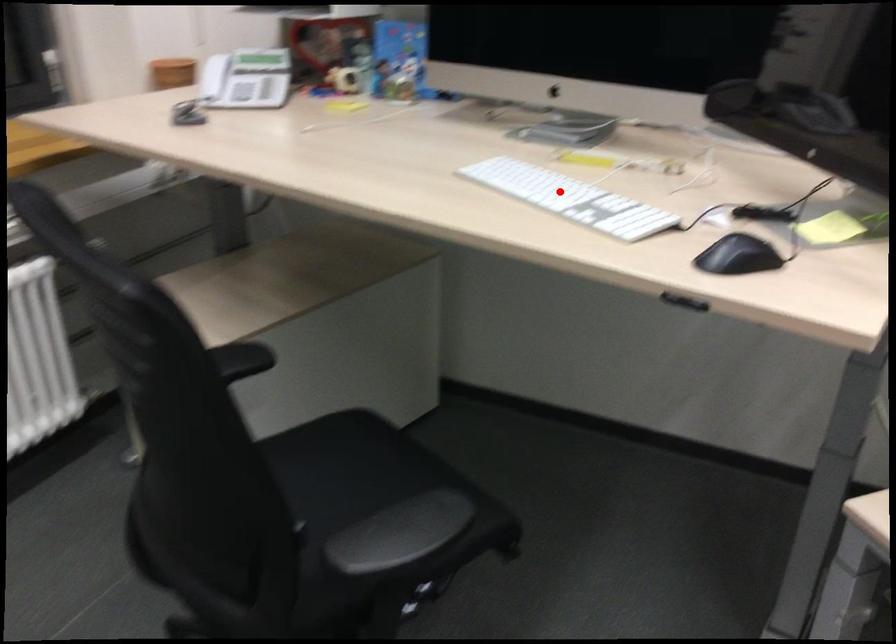
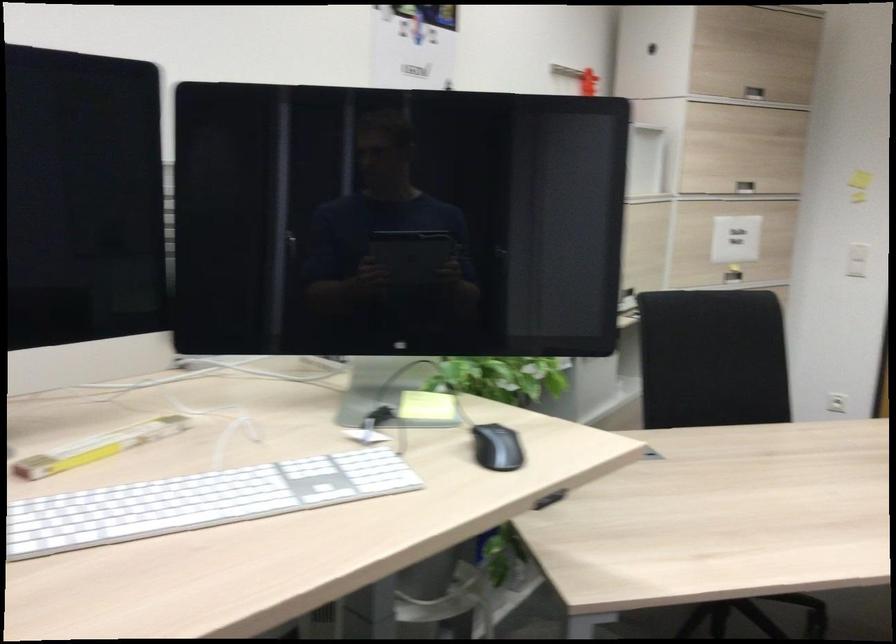
Locate, in the second image, the point that corresponds to the highlighted location in the first image.

(200, 500)